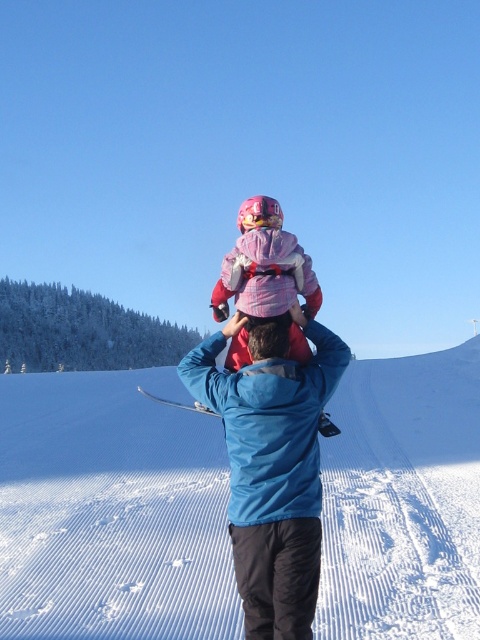
You are planning to build a snowman using the white snow at center and wearing the blue fabric jacket at center. Which material is more suitable for the base of the snowman?

The white snow at center is more suitable for the base of the snowman because it has a larger size compared to the blue fabric jacket at center.

You are a parent planning to take your child to play in the snow. Looking at the image, where is the blue fabric jacket at center in relation to the white snow at center?

The blue fabric jacket at center is above the white snow at center, as the white snow at center is located below it.